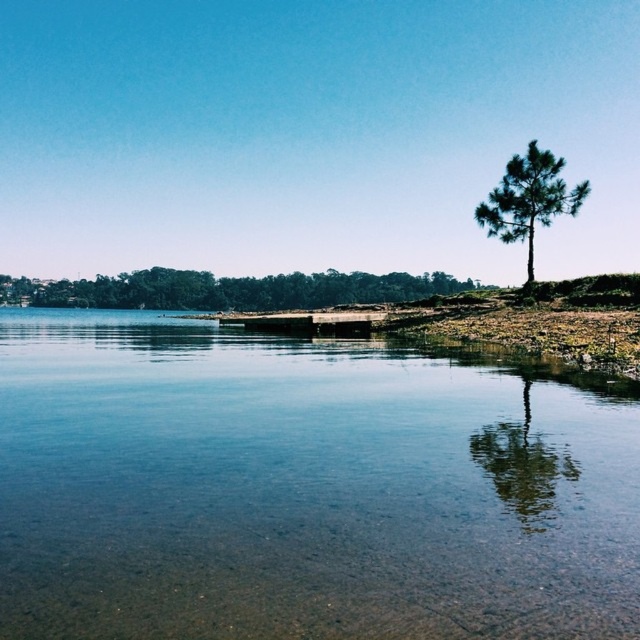
You are a kayaker planning to paddle from the wooden dock at center to the clear water at center. Based on the scene, which area is more spacious for maneuvering your kayak?

The clear water at center has a larger size compared to the wooden dock at center, so it is more spacious for maneuvering the kayak.

Based on the photo, you are a photographer planning to capture the green matte tree at upper right and the wooden dock at center in a single frame. Considering their sizes, which object should you focus on first to ensure both are clearly visible in your photo?

The green matte tree at upper right is smaller in size compared to the wooden dock at center. To ensure both are clearly visible, focus on the wooden dock at center first since it is larger and will require more attention in framing.

You are standing at the lakeside and want to reach the point marked at coordinates (x=252, y=417). Considering the dock is 20 meters long, can you walk directly to that point from your current position?

The point at (x=252, y=417) is 21.99 meters away from you, which is slightly beyond the dock length of 20 meters. You cannot reach it directly by walking on the dock.